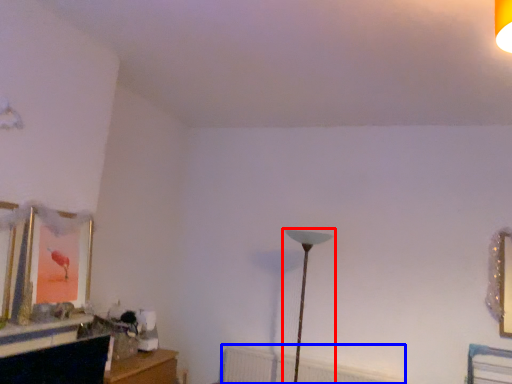
Question: Which object appears closest to the camera in this image, lamp (highlighted by a red box) or radiator (highlighted by a blue box)?

Choices:
 (A) lamp
 (B) radiator

Answer: (A)